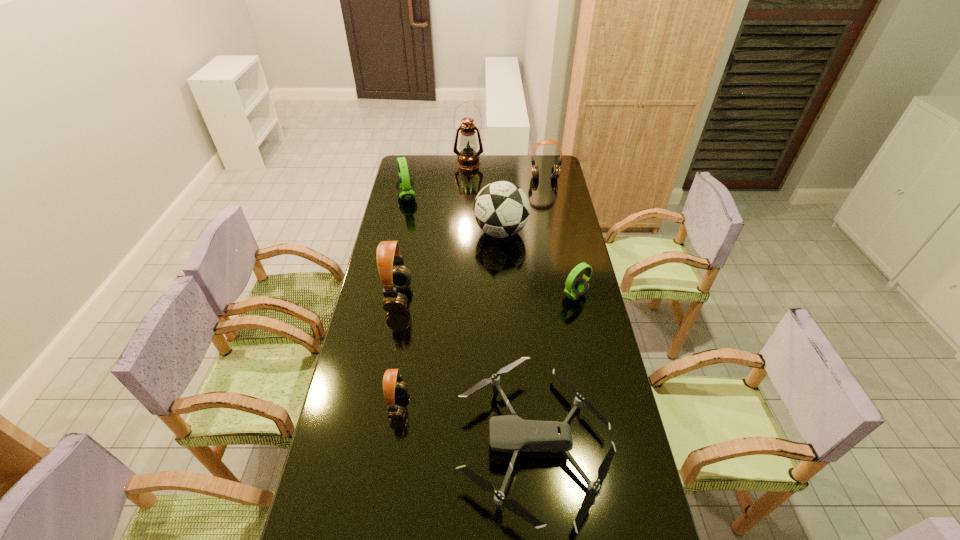
This screenshot has width=960, height=540. Find the location of `vacant space at the far right corner of the desktop`. vacant space at the far right corner of the desktop is located at coordinates (553, 163).

Locate an element on the screen. vacant space in between the nearest brown headset and the tallest headset is located at coordinates (398, 352).

The height and width of the screenshot is (540, 960). I want to click on free spot between the left green headset and the rightmost brown headset, so click(475, 187).

Point out which object is positioned as the fifth nearest to the nearer green headset. Please provide its 2D coordinates. Your answer should be formatted as a tuple, i.e. [(x, y)], where the tuple contains the x and y coordinates of a point satisfying the conditions above.

[(555, 170)]

Identify which object is the seventh closest to the oil lamp. Please provide its 2D coordinates. Your answer should be formatted as a tuple, i.e. [(x, y)], where the tuple contains the x and y coordinates of a point satisfying the conditions above.

[(393, 386)]

Identify which headset is the fourth nearest to the farthest headset. Please provide its 2D coordinates. Your answer should be formatted as a tuple, i.e. [(x, y)], where the tuple contains the x and y coordinates of a point satisfying the conditions above.

[(393, 386)]

Point out which headset is positioned as the third nearest to the biggest brown headset. Please provide its 2D coordinates. Your answer should be formatted as a tuple, i.e. [(x, y)], where the tuple contains the x and y coordinates of a point satisfying the conditions above.

[(574, 288)]

Select which brown headset appears as the second closest to the farthest brown headset. Please provide its 2D coordinates. Your answer should be formatted as a tuple, i.e. [(x, y)], where the tuple contains the x and y coordinates of a point satisfying the conditions above.

[(393, 386)]

Choose which brown headset is the third nearest neighbor to the bigger green headset. Please provide its 2D coordinates. Your answer should be formatted as a tuple, i.e. [(x, y)], where the tuple contains the x and y coordinates of a point satisfying the conditions above.

[(393, 386)]

Where is `free region that satisfies the following two spatial constraints: 1. on the back side of the oil lamp; 2. on the right side of the third farthest object`? The image size is (960, 540). free region that satisfies the following two spatial constraints: 1. on the back side of the oil lamp; 2. on the right side of the third farthest object is located at coordinates (414, 163).